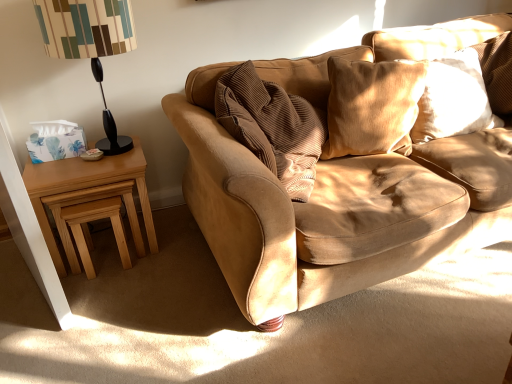
Question: Considering the relative sizes of light brown wooden stool at lower left and white satin pillow at upper right, positioned as the first pillow in right-to-left order, in the image provided, is light brown wooden stool at lower left smaller than white satin pillow at upper right, positioned as the first pillow in right-to-left order,?

Choices:
 (A) no
 (B) yes

Answer: (B)

Question: Is light brown wooden stool at lower left closer to camera compared to white satin pillow at upper right, the second pillow from the left?

Choices:
 (A) yes
 (B) no

Answer: (A)

Question: Is light brown wooden stool at lower left not near white satin pillow at upper right, positioned as the first pillow in right-to-left order?

Choices:
 (A) yes
 (B) no

Answer: (A)

Question: Is light brown wooden stool at lower left further to the viewer compared to white satin pillow at upper right, positioned as the first pillow in right-to-left order?

Choices:
 (A) yes
 (B) no

Answer: (B)

Question: Are light brown wooden stool at lower left and white satin pillow at upper right, positioned as the first pillow in right-to-left order, making contact?

Choices:
 (A) yes
 (B) no

Answer: (B)

Question: From the image's perspective, does light brown wooden stool at lower left appear higher than white satin pillow at upper right, the second pillow from the left?

Choices:
 (A) yes
 (B) no

Answer: (B)

Question: Does light brown wood nesting tables at left have a greater height compared to black plastic table lamp at left?

Choices:
 (A) yes
 (B) no

Answer: (B)

Question: From the image's perspective, does light brown wood nesting tables at left appear lower than black plastic table lamp at left?

Choices:
 (A) yes
 (B) no

Answer: (A)

Question: Is black plastic table lamp at left at the back of light brown wood nesting tables at left?

Choices:
 (A) no
 (B) yes

Answer: (A)

Question: Is the position of light brown wood nesting tables at left more distant than that of black plastic table lamp at left?

Choices:
 (A) yes
 (B) no

Answer: (A)

Question: Considering the relative sizes of light brown wood nesting tables at left and black plastic table lamp at left in the image provided, is light brown wood nesting tables at left bigger than black plastic table lamp at left?

Choices:
 (A) no
 (B) yes

Answer: (B)

Question: Does light brown wood nesting tables at left appear on the left side of black plastic table lamp at left?

Choices:
 (A) yes
 (B) no

Answer: (A)

Question: Is black plastic table lamp at left with suede cushion at upper right, the second pillow when ordered from right to left?

Choices:
 (A) yes
 (B) no

Answer: (B)